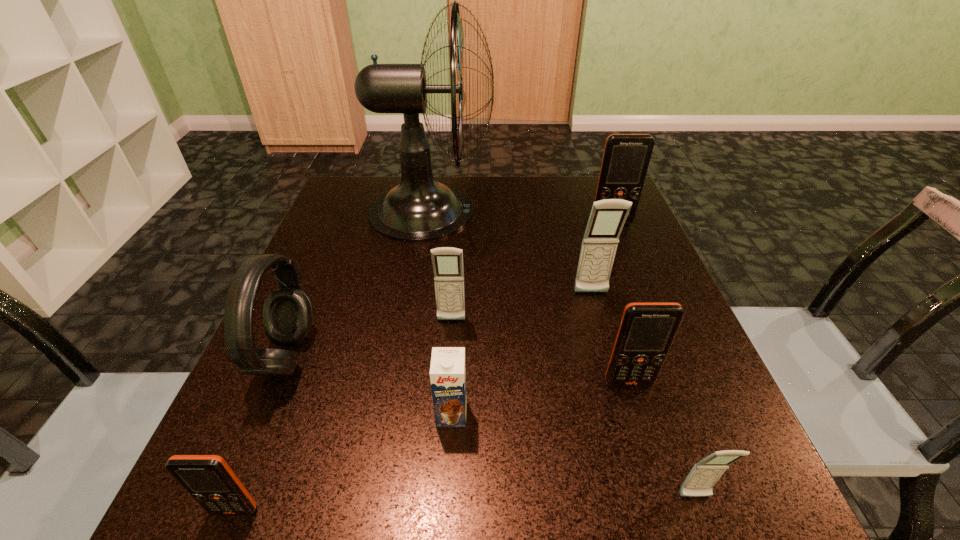
I want to click on vacant region between the nearest gray cellular telephone and the gray headset, so click(x=492, y=427).

Image resolution: width=960 pixels, height=540 pixels. I want to click on vacant area that lies between the chocolate milk and the headset, so click(370, 385).

Find the location of a particular element. This screenshot has height=540, width=960. free space between the leftmost cellular telephone and the biggest gray cellular telephone is located at coordinates (413, 402).

This screenshot has height=540, width=960. I want to click on free space between the fan and the nearest orange cellular telephone, so click(x=332, y=361).

What are the coordinates of `vacant area that lies between the farthest orange cellular telephone and the second biggest orange cellular telephone` in the screenshot? It's located at (620, 303).

Image resolution: width=960 pixels, height=540 pixels. I want to click on free spot between the second biggest orange cellular telephone and the fifth cellular telephone from right to left, so pos(540,352).

Image resolution: width=960 pixels, height=540 pixels. Find the location of `vacant region between the second cellular telephone from left to right and the second smallest orange cellular telephone`. vacant region between the second cellular telephone from left to right and the second smallest orange cellular telephone is located at coordinates (540, 352).

The image size is (960, 540). I want to click on object that is the sixth closest one to the fan, so click(x=447, y=370).

Identify which object is located as the fourth nearest to the second farthest gray cellular telephone. Please provide its 2D coordinates. Your answer should be formatted as a tuple, i.e. [(x, y)], where the tuple contains the x and y coordinates of a point satisfying the conditions above.

[(607, 217)]

What are the coordinates of `cellular telephone that is the nearest to the leftmost cellular telephone` in the screenshot? It's located at (447, 262).